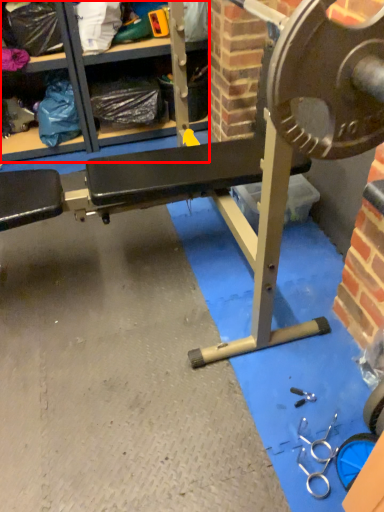
Question: From the image's perspective, what is the correct spatial relationship of shelf (annotated by the red box) in relation to bench?

Choices:
 (A) below
 (B) above

Answer: (B)